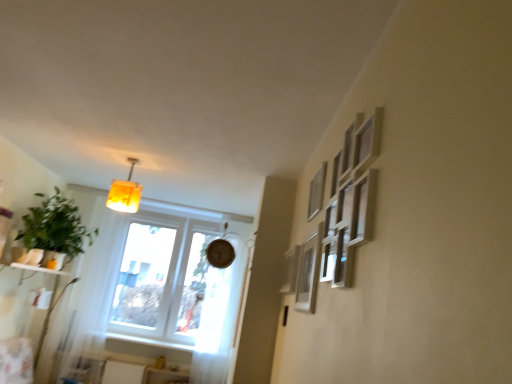
Describe the element at coordinates (217, 324) in the screenshot. I see `white sheer curtain at center` at that location.

This screenshot has height=384, width=512. What do you see at coordinates (308, 273) in the screenshot?
I see `matte silver picture frame at right, positioned as the 1th picture frame in front-to-back order` at bounding box center [308, 273].

Identify the location of white painted wood at lower left. (149, 342).

What is the approximate width of white painted wood at lower left?

white painted wood at lower left is 7.39 inches wide.

Identify the location of matte yellow plastic lamp at upper left. (125, 193).

Locate an element on the screen. picture frame that is the 3rd one above the white sheer curtain at center (from a real-world perspective) is located at coordinates (317, 192).

Is white sheer curtain at center at the back of matte silver picture frame at upper right, which is the 2th picture frame in front-to-back order?

That's not correct — matte silver picture frame at upper right, which is the 2th picture frame in front-to-back order, is not looking away from white sheer curtain at center.

From the image's perspective, relative to white sheer curtain at center, is matte silver picture frame at upper right, the 2th picture frame from the back, above or below?

matte silver picture frame at upper right, the 2th picture frame from the back, is situated higher than white sheer curtain at center in the image.

From the picture: Can we say matte silver picture frame at upper right, the 2th picture frame from the back, lies outside white sheer curtain at center?

Absolutely, matte silver picture frame at upper right, the 2th picture frame from the back, is external to white sheer curtain at center.

From the image's perspective, relative to matte silver picture frame at upper right, the third picture frame when ordered from front to back, is matte yellow plastic lamp at upper left above or below?

matte yellow plastic lamp at upper left is above matte silver picture frame at upper right, the third picture frame when ordered from front to back.

Looking at the image, does matte yellow plastic lamp at upper left seem bigger or smaller compared to matte silver picture frame at upper right, the third picture frame when ordered from front to back?

matte yellow plastic lamp at upper left is bigger than matte silver picture frame at upper right, the third picture frame when ordered from front to back.

Image resolution: width=512 pixels, height=384 pixels. I want to click on lamp that is above the matte silver picture frame at upper right, the third picture frame when ordered from front to back (from the image's perspective), so click(x=125, y=193).

In the scene shown: Relative to matte silver picture frame at upper right, the third picture frame when ordered from front to back, is matte yellow plastic lamp at upper left in front or behind?

matte yellow plastic lamp at upper left is behind matte silver picture frame at upper right, the third picture frame when ordered from front to back.

Does point (54, 223) appear closer or farther from the camera than point (304, 270)?

Point (54, 223) is farther from the camera than point (304, 270).

Does green matte plant at left have a greater height compared to matte silver picture frame at right, positioned as the 1th picture frame in front-to-back order?

Indeed, green matte plant at left has a greater height compared to matte silver picture frame at right, positioned as the 1th picture frame in front-to-back order.

Visually, is green matte plant at left positioned to the left or to the right of matte silver picture frame at right, positioned as the 1th picture frame in front-to-back order?

In the image, green matte plant at left appears on the left side of matte silver picture frame at right, positioned as the 1th picture frame in front-to-back order.

Considering the sizes of objects white sheer curtain at center and matte yellow plastic lamp at upper left in the image provided, who is wider, white sheer curtain at center or matte yellow plastic lamp at upper left?

matte yellow plastic lamp at upper left.

Based on the photo, considering the relative positions of white sheer curtain at center and matte yellow plastic lamp at upper left in the image provided, is white sheer curtain at center to the left or to the right of matte yellow plastic lamp at upper left?

white sheer curtain at center is to the right of matte yellow plastic lamp at upper left.

In the scene shown: Is white sheer curtain at center not inside matte yellow plastic lamp at upper left?

That's correct, white sheer curtain at center is outside of matte yellow plastic lamp at upper left.

Is white sheer curtain at center far away from matte silver picture frame at right, arranged as the 3th picture frame when viewed from the back?

white sheer curtain at center is positioned a significant distance from matte silver picture frame at right, arranged as the 3th picture frame when viewed from the back.

Looking at this image, which of these two, white sheer curtain at center or matte silver picture frame at right, positioned as the 1th picture frame in front-to-back order, stands shorter?

matte silver picture frame at right, positioned as the 1th picture frame in front-to-back order, is shorter.

What's the angular difference between white sheer curtain at center and matte silver picture frame at right, arranged as the 3th picture frame when viewed from the back,'s facing directions?

89.9 degrees.

Would you say white sheer curtain at center is to the left or to the right of matte silver picture frame at right, arranged as the 3th picture frame when viewed from the back, in the picture?

Clearly, white sheer curtain at center is on the left of matte silver picture frame at right, arranged as the 3th picture frame when viewed from the back, in the image.

Consider the image. From a real-world perspective, does white sheer curtain at center sit lower than green matte plant at left?

Yes, from a real-world perspective, white sheer curtain at center is under green matte plant at left.

Is white sheer curtain at center positioned far away from green matte plant at left?

white sheer curtain at center is far away from green matte plant at left.

Measure the distance between white sheer curtain at center and green matte plant at left.

white sheer curtain at center is 1.56 meters from green matte plant at left.

Is point (227, 289) positioned before point (78, 219)?

No, it is not.

Can you confirm if matte silver picture frame at upper right, the third picture frame when ordered from front to back, is thinner than white sheer curtain at center?

Correct, the width of matte silver picture frame at upper right, the third picture frame when ordered from front to back, is less than that of white sheer curtain at center.

Is matte silver picture frame at upper right, the third picture frame when ordered from front to back, oriented towards white sheer curtain at center?

No, matte silver picture frame at upper right, the third picture frame when ordered from front to back, is not facing towards white sheer curtain at center.

Is point (293, 290) closer to viewer compared to point (219, 313)?

Yes, it is in front of point (219, 313).

Can you tell me how much matte silver picture frame at upper right, the third picture frame when ordered from front to back, and white sheer curtain at center differ in facing direction?

The facing directions of matte silver picture frame at upper right, the third picture frame when ordered from front to back, and white sheer curtain at center are 89.9 degrees apart.

Where is `the 3rd picture frame positioned above the white sheer curtain at center (from the image's perspective)`? The width and height of the screenshot is (512, 384). the 3rd picture frame positioned above the white sheer curtain at center (from the image's perspective) is located at coordinates (317, 192).

Find the location of a particular element. lamp above the matte silver picture frame at upper right, which ranks as the 1th picture frame in back-to-front order (from a real-world perspective) is located at coordinates (x=125, y=193).

Considering their positions, is matte silver picture frame at upper right, which is the 2th picture frame in front-to-back order, positioned further to matte silver picture frame at right, arranged as the 3th picture frame when viewed from the back, than matte yellow plastic lamp at upper left?

The object further to matte silver picture frame at right, arranged as the 3th picture frame when viewed from the back, is matte yellow plastic lamp at upper left.

From the image, which object appears to be farther from white painted wood at lower left, matte yellow plastic lamp at upper left or white sheer curtain at center?

Based on the image, matte yellow plastic lamp at upper left appears to be further to white painted wood at lower left.

Looking at the image, which one is located closer to white sheer curtain at center, matte silver picture frame at upper right, the 2th picture frame from the back, or green matte plant at left?

green matte plant at left.

Considering their positions, is matte yellow plastic lamp at upper left positioned closer to matte silver picture frame at upper right, the third picture frame when ordered from front to back, than matte silver picture frame at right, arranged as the 3th picture frame when viewed from the back?

Based on the image, matte silver picture frame at right, arranged as the 3th picture frame when viewed from the back, appears to be nearer to matte silver picture frame at upper right, the third picture frame when ordered from front to back.

Estimate the real-world distances between objects in this image. Which object is closer to matte silver picture frame at upper right, which ranks as the 1th picture frame in back-to-front order, matte silver picture frame at upper right, the 2th picture frame from the back, or white painted wood at lower left?

Based on the image, matte silver picture frame at upper right, the 2th picture frame from the back, appears to be nearer to matte silver picture frame at upper right, which ranks as the 1th picture frame in back-to-front order.

When comparing their distances from matte silver picture frame at upper right, the third picture frame when ordered from front to back, does green matte plant at left or white sheer curtain at center seem closer?

The object closer to matte silver picture frame at upper right, the third picture frame when ordered from front to back, is white sheer curtain at center.

Considering their positions, is matte silver picture frame at right, arranged as the 3th picture frame when viewed from the back, positioned closer to green matte plant at left than matte yellow plastic lamp at upper left?

Based on the image, matte yellow plastic lamp at upper left appears to be nearer to green matte plant at left.

Looking at the image, which one is located closer to matte silver picture frame at right, arranged as the 3th picture frame when viewed from the back, matte silver picture frame at upper right, which ranks as the 1th picture frame in back-to-front order, or white sheer curtain at center?

Among the two, matte silver picture frame at upper right, which ranks as the 1th picture frame in back-to-front order, is located nearer to matte silver picture frame at right, arranged as the 3th picture frame when viewed from the back.

The image size is (512, 384). Find the location of `houseplant between matte silver picture frame at upper right, which ranks as the 1th picture frame in back-to-front order, and white painted wood at lower left in the front-back direction`. houseplant between matte silver picture frame at upper right, which ranks as the 1th picture frame in back-to-front order, and white painted wood at lower left in the front-back direction is located at coordinates (55, 227).

You are a GUI agent. You are given a task and a screenshot of the screen. Output one action in this format:
    pyautogui.click(x=<x>, y=<y>)
    Task: Click on the curtain located between green matte plant at left and matte silver picture frame at upper right, which ranks as the 1th picture frame in back-to-front order, in the left-right direction
    
    Given the screenshot: What is the action you would take?
    pyautogui.click(x=217, y=324)

You are a GUI agent. You are given a task and a screenshot of the screen. Output one action in this format:
    pyautogui.click(x=<x>, y=<y>)
    Task: Click on the curtain between matte silver picture frame at upper right, the third picture frame when ordered from front to back, and white painted wood at lower left, along the z-axis
    
    Given the screenshot: What is the action you would take?
    pyautogui.click(x=217, y=324)

At what (x,y) coordinates should I click in order to perform the action: click on lamp located between matte silver picture frame at right, arranged as the 3th picture frame when viewed from the back, and white painted wood at lower left in the depth direction. Please return your answer as a coordinate pair (x, y). This screenshot has height=384, width=512. Looking at the image, I should click on tap(125, 193).